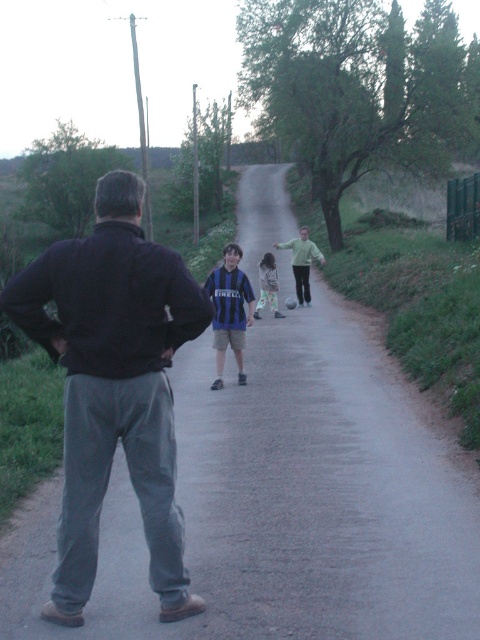
Image resolution: width=480 pixels, height=640 pixels. I want to click on dark gray sweatpants at center, so click(113, 385).

Can you confirm if dark gray sweatpants at center is bigger than green fleece jacket at center?

Actually, dark gray sweatpants at center might be smaller than green fleece jacket at center.

Locate an element on the screen. The image size is (480, 640). dark gray sweatpants at center is located at coordinates (113, 385).

Looking at this image, does blue striped jersey at center have a smaller size compared to green fleece jacket at center?

Yes, blue striped jersey at center is smaller than green fleece jacket at center.

Who is more forward, (227, 280) or (297, 253)?

Positioned in front is point (227, 280).

Is point (243, 330) farther from viewer compared to point (310, 256)?

No.

At what (x,y) coordinates should I click in order to perform the action: click on blue striped jersey at center. Please return your answer as a coordinate pair (x, y). This screenshot has width=480, height=640. Looking at the image, I should click on (229, 310).

Is point (302, 278) farther from camera compared to point (276, 312)?

That is True.

Who is more forward, (x=300, y=248) or (x=271, y=273)?

Point (x=271, y=273)

Where is `green fleece jacket at center`? Image resolution: width=480 pixels, height=640 pixels. green fleece jacket at center is located at coordinates (301, 262).